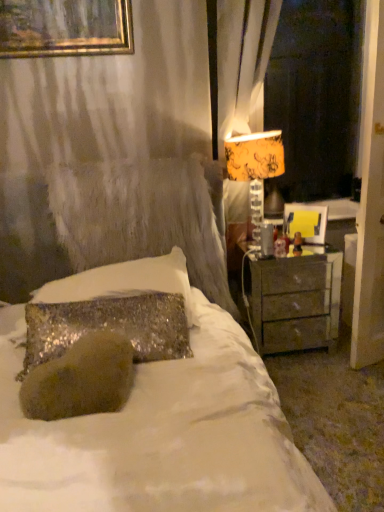
Question: From a real-world perspective, is matte gray nightstand at right positioned under sparkly silver pillow at center based on gravity?

Choices:
 (A) no
 (B) yes

Answer: (B)

Question: From the image's perspective, is matte gray nightstand at right below sparkly silver pillow at center?

Choices:
 (A) no
 (B) yes

Answer: (B)

Question: Considering the relative sizes of matte gray nightstand at right and sparkly silver pillow at center in the image provided, is matte gray nightstand at right wider than sparkly silver pillow at center?

Choices:
 (A) no
 (B) yes

Answer: (A)

Question: Is matte gray nightstand at right in contact with sparkly silver pillow at center?

Choices:
 (A) no
 (B) yes

Answer: (A)

Question: From a real-world perspective, is matte gray nightstand at right on sparkly silver pillow at center?

Choices:
 (A) no
 (B) yes

Answer: (A)

Question: From the image's perspective, does matte gray nightstand at right appear higher than sparkly silver pillow at center?

Choices:
 (A) yes
 (B) no

Answer: (B)

Question: Does sparkly silver pillow at center have a lesser width compared to yellow fabric lampshade at upper right?

Choices:
 (A) yes
 (B) no

Answer: (B)

Question: Can you confirm if sparkly silver pillow at center is taller than yellow fabric lampshade at upper right?

Choices:
 (A) yes
 (B) no

Answer: (B)

Question: From the image's perspective, does sparkly silver pillow at center appear higher than yellow fabric lampshade at upper right?

Choices:
 (A) no
 (B) yes

Answer: (A)

Question: Does sparkly silver pillow at center have a larger size compared to yellow fabric lampshade at upper right?

Choices:
 (A) yes
 (B) no

Answer: (A)

Question: Considering the relative positions of sparkly silver pillow at center and yellow fabric lampshade at upper right in the image provided, is sparkly silver pillow at center to the left of yellow fabric lampshade at upper right from the viewer's perspective?

Choices:
 (A) yes
 (B) no

Answer: (A)

Question: Is the position of sparkly silver pillow at center more distant than that of yellow fabric lampshade at upper right?

Choices:
 (A) no
 (B) yes

Answer: (A)

Question: Is sparkly silver pillow at center located outside matte gray nightstand at right?

Choices:
 (A) yes
 (B) no

Answer: (A)